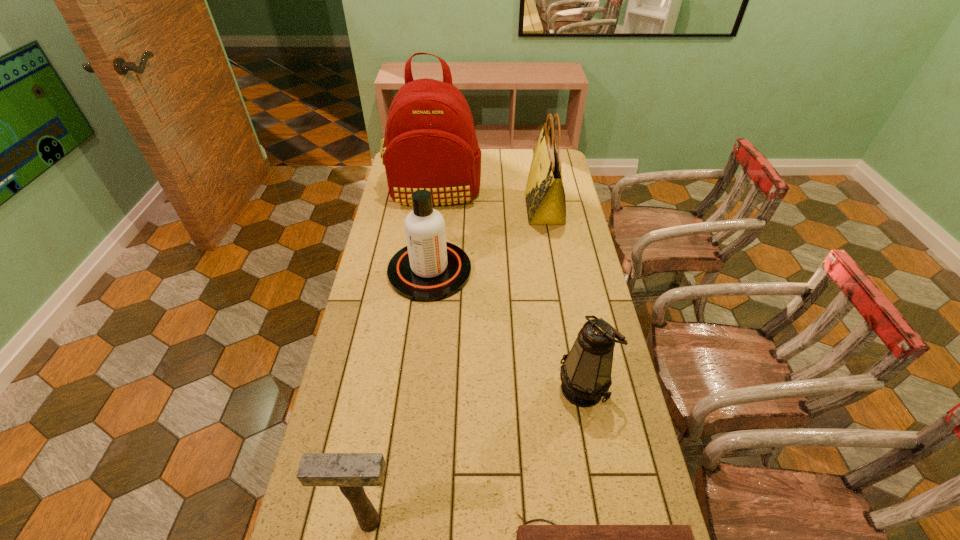
Where is `vacant space that's between the second tallest object and the oil lamp`? The image size is (960, 540). vacant space that's between the second tallest object and the oil lamp is located at coordinates (564, 299).

The image size is (960, 540). In order to click on blank region between the backpack and the mallet in this screenshot , I will do coord(401,357).

What are the coordinates of `vacant area that lies between the mallet and the fifth shortest object` in the screenshot? It's located at (457, 365).

The width and height of the screenshot is (960, 540). Identify the location of free space between the cleansing agent and the oil lamp. (x=507, y=329).

Locate an element on the screen. The image size is (960, 540). vacant area that lies between the fourth farthest object and the cleansing agent is located at coordinates (507, 329).

Image resolution: width=960 pixels, height=540 pixels. I want to click on vacant area that lies between the second tallest object and the third nearest object, so click(564, 299).

Locate which object is the second closest to the cleansing agent. Please provide its 2D coordinates. Your answer should be formatted as a tuple, i.e. [(x, y)], where the tuple contains the x and y coordinates of a point satisfying the conditions above.

[(545, 198)]

Where is `object that is the fifth closest to the mallet`? This screenshot has height=540, width=960. object that is the fifth closest to the mallet is located at coordinates (430, 143).

Where is `free space that satisfies the following two spatial constraints: 1. on the front-facing side of the second tallest object; 2. on the left side of the fourth farthest object`? This screenshot has height=540, width=960. free space that satisfies the following two spatial constraints: 1. on the front-facing side of the second tallest object; 2. on the left side of the fourth farthest object is located at coordinates (575, 388).

At what (x,y) coordinates should I click in order to perform the action: click on vacant space that satisfies the following two spatial constraints: 1. on the front-facing side of the backpack; 2. on the right side of the cleansing agent. Please return your answer as a coordinate pair (x, y). This screenshot has width=960, height=540. Looking at the image, I should click on (423, 271).